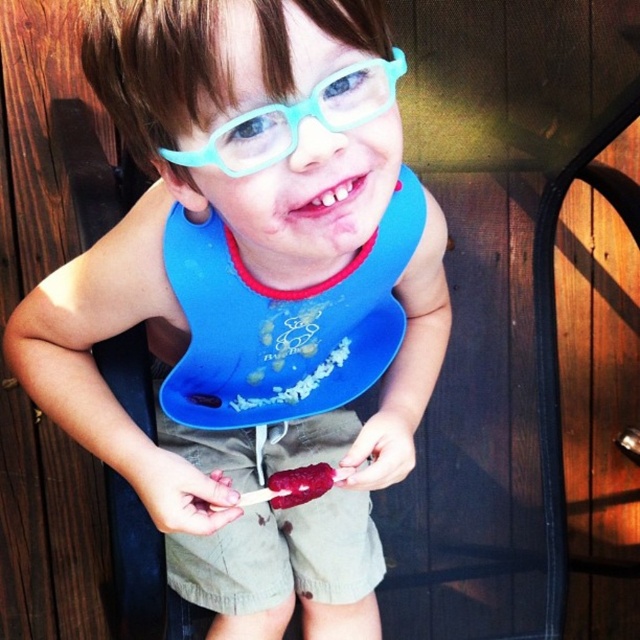
Between tinted plastic glasses at upper center and smooth raspberry ice cream at center, which one is positioned lower?

smooth raspberry ice cream at center is lower down.

Find the location of a particular element. This screenshot has height=640, width=640. tinted plastic glasses at upper center is located at coordinates (298, 118).

Find the location of a particular element. The height and width of the screenshot is (640, 640). tinted plastic glasses at upper center is located at coordinates (298, 118).

Does blue rubber bib at center have a greater width compared to tinted plastic glasses at upper center?

Indeed, blue rubber bib at center has a greater width compared to tinted plastic glasses at upper center.

Is blue rubber bib at center above tinted plastic glasses at upper center?

Actually, blue rubber bib at center is below tinted plastic glasses at upper center.

Between point (328, 84) and point (268, 163), which one is positioned in front?

Point (328, 84) is more forward.

The height and width of the screenshot is (640, 640). I want to click on blue rubber bib at center, so click(252, 298).

Does blue rubber bib at center have a smaller size compared to smooth raspberry ice cream at center?

No.

Which is in front, point (342, 620) or point (280, 480)?

Point (280, 480)

Does point (316, 369) come in front of point (321, 472)?

No, it is not.

The width and height of the screenshot is (640, 640). What are the coordinates of `blue rubber bib at center` in the screenshot? It's located at (252, 298).